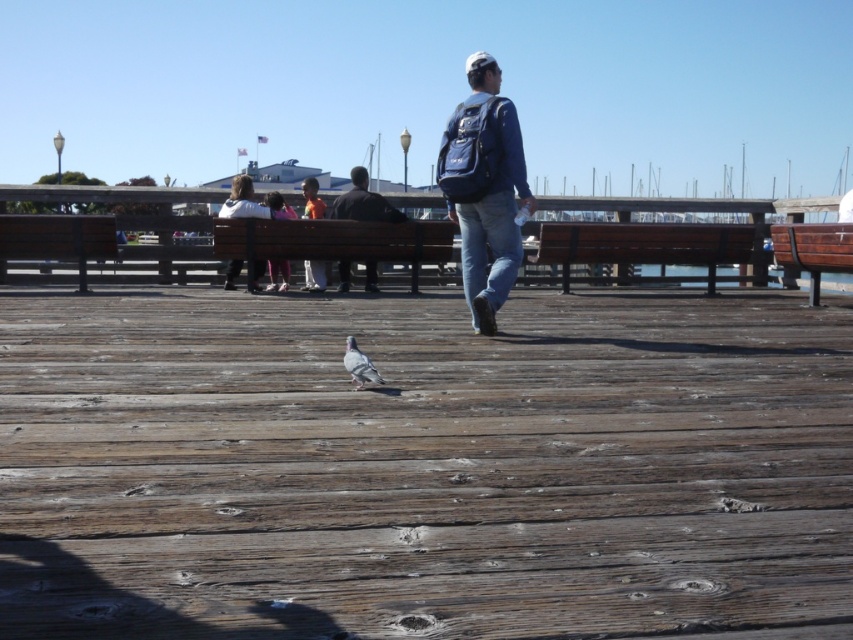
You are standing at the camera position and want to toss a small ball to the person wearing the white cotton jacket at center. Is the distance feasible for a typical adult to throw the ball?

The distance between the white cotton jacket at center and the camera is 10.41 meters. A typical adult can throw a ball about 20 to 30 meters, so yes, the distance is feasible for a typical adult to throw the ball.

You are a photographer standing at the waterfront boardwalk. You want to take a photo of the brown wooden deck at center and the white cotton jacket at center. Based on their sizes, which object should you focus on first if you want both to be in sharp focus?

The brown wooden deck at center has a smaller size compared to white cotton jacket at center. To ensure both are in sharp focus, you should focus on the white cotton jacket at center first since it is larger and closer to the camera.

You are standing on the brown wooden deck at center and want to see over the white cotton jacket at center. Can you see over it from your current position?

The brown wooden deck at center is shorter than the white cotton jacket at center, so you cannot see over it from your current position.